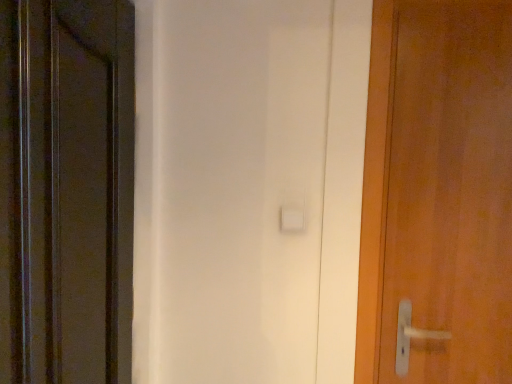
Question: Is wooden door at right, which appears as the 1th door when viewed from the right, located within matte black door at left, placed as the first door when sorted from left to right?

Choices:
 (A) yes
 (B) no

Answer: (B)

Question: Is matte black door at left, placed as the first door when sorted from left to right, shorter than wooden door at right, which appears as the 1th door when viewed from the right?

Choices:
 (A) no
 (B) yes

Answer: (A)

Question: Is matte black door at left, placed as the first door when sorted from left to right, positioned far away from wooden door at right, which is the second door from left to right?

Choices:
 (A) yes
 (B) no

Answer: (B)

Question: Considering the relative sizes of matte black door at left, arranged as the 2th door when viewed from the right, and wooden door at right, which is the second door from left to right, in the image provided, is matte black door at left, arranged as the 2th door when viewed from the right, bigger than wooden door at right, which is the second door from left to right,?

Choices:
 (A) yes
 (B) no

Answer: (A)

Question: Is matte black door at left, placed as the first door when sorted from left to right, to the left of wooden door at right, which is the second door from left to right, from the viewer's perspective?

Choices:
 (A) no
 (B) yes

Answer: (B)

Question: Does matte black door at left, placed as the first door when sorted from left to right, have a smaller size compared to wooden door at right, which is the second door from left to right?

Choices:
 (A) no
 (B) yes

Answer: (A)

Question: From the image's perspective, would you say wooden door at right, which is the second door from left to right, is positioned over matte black door at left, placed as the first door when sorted from left to right?

Choices:
 (A) no
 (B) yes

Answer: (B)

Question: Does wooden door at right, which is the second door from left to right, contain matte black door at left, placed as the first door when sorted from left to right?

Choices:
 (A) yes
 (B) no

Answer: (B)

Question: Could you tell me if wooden door at right, which appears as the 1th door when viewed from the right, is turned towards matte black door at left, placed as the first door when sorted from left to right?

Choices:
 (A) no
 (B) yes

Answer: (A)

Question: Is wooden door at right, which is the second door from left to right, smaller than matte black door at left, placed as the first door when sorted from left to right?

Choices:
 (A) yes
 (B) no

Answer: (A)

Question: Is wooden door at right, which appears as the 1th door when viewed from the right, not within matte black door at left, arranged as the 2th door when viewed from the right?

Choices:
 (A) yes
 (B) no

Answer: (A)

Question: Is wooden door at right, which appears as the 1th door when viewed from the right, to the left of matte black door at left, placed as the first door when sorted from left to right, from the viewer's perspective?

Choices:
 (A) yes
 (B) no

Answer: (B)

Question: In the image, is wooden door at right, which appears as the 1th door when viewed from the right, positioned in front of or behind matte black door at left, placed as the first door when sorted from left to right?

Choices:
 (A) behind
 (B) front

Answer: (A)